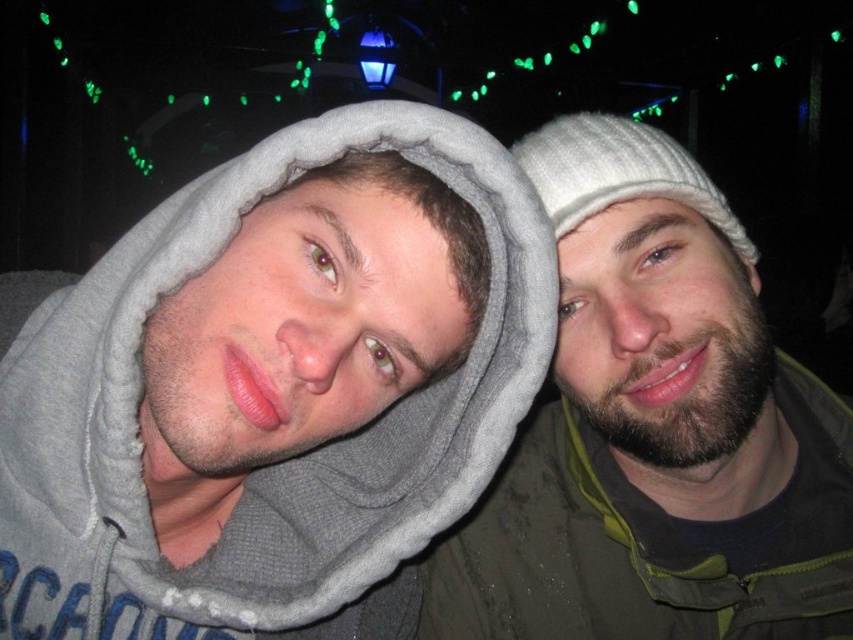
Does gray fleece hoodie at left come in front of white knitted hat at upper right?

Yes.

Does gray fleece hoodie at left appear on the right side of white knitted hat at upper right?

Incorrect, gray fleece hoodie at left is not on the right side of white knitted hat at upper right.

What do you see at coordinates (265, 467) in the screenshot? Image resolution: width=853 pixels, height=640 pixels. I see `gray fleece hoodie at left` at bounding box center [265, 467].

The image size is (853, 640). I want to click on gray fleece hoodie at left, so click(x=265, y=467).

Between bearded man at right and white knitted hat at upper right, which one is positioned higher?

white knitted hat at upper right is above.

Does bearded man at right appear on the left side of white knitted hat at upper right?

No, bearded man at right is not to the left of white knitted hat at upper right.

Which is behind, point (521, 570) or point (665, 188)?

Positioned behind is point (521, 570).

You are a GUI agent. You are given a task and a screenshot of the screen. Output one action in this format:
    pyautogui.click(x=<x>, y=<y>)
    Task: Click on the bearded man at right
    This screenshot has width=853, height=640.
    Given the screenshot: What is the action you would take?
    pyautogui.click(x=654, y=429)

Can you confirm if gray fleece hoodie at left is taller than bearded man at right?

Incorrect, gray fleece hoodie at left's height is not larger of bearded man at right's.

Between gray fleece hoodie at left and bearded man at right, which one appears on the right side from the viewer's perspective?

bearded man at right is more to the right.

Does point (364, 125) lie behind point (706, 392)?

That is False.

Find the location of a particular element. gray fleece hoodie at left is located at coordinates (265, 467).